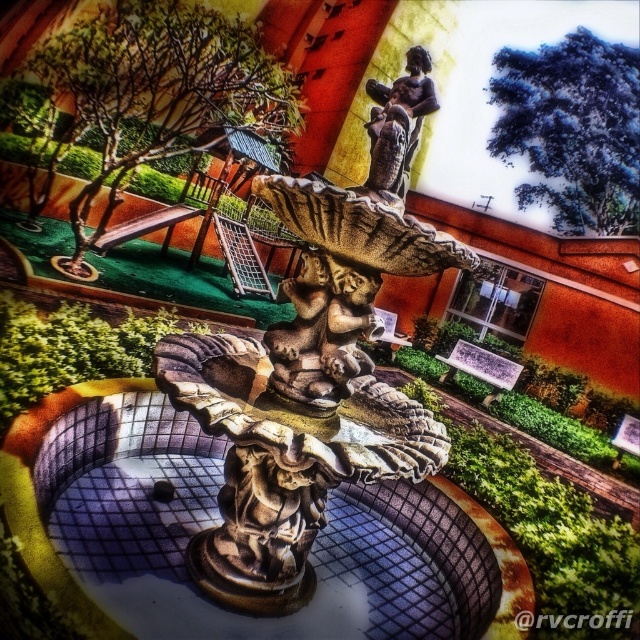
Question: Can you confirm if stone fountain at center is positioned above bronze statue at center?

Choices:
 (A) yes
 (B) no

Answer: (B)

Question: Which point is closer to the camera?

Choices:
 (A) stone fountain at center
 (B) bronze statue at center

Answer: (A)

Question: Can you confirm if stone fountain at center is thinner than bronze statue at center?

Choices:
 (A) no
 (B) yes

Answer: (A)

Question: Which object is farther from the camera taking this photo?

Choices:
 (A) bronze statue at center
 (B) stone fountain at center

Answer: (A)

Question: Which of the following is the closest to the observer?

Choices:
 (A) bronze statue at center
 (B) stone fountain at center

Answer: (B)

Question: Is stone fountain at center to the right of bronze statue at center from the viewer's perspective?

Choices:
 (A) yes
 (B) no

Answer: (B)